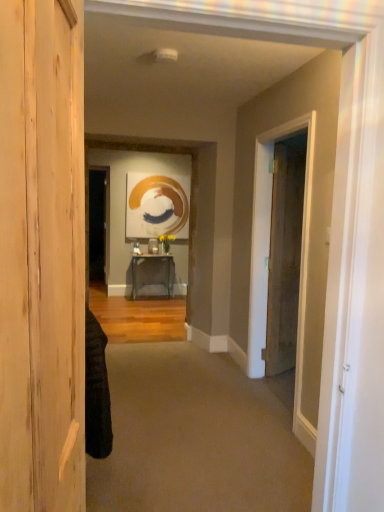
This screenshot has height=512, width=384. Describe the element at coordinates (285, 254) in the screenshot. I see `brown wood door at right, the second door in the front-to-back sequence` at that location.

Identify the location of metallic gray table at center. This screenshot has height=512, width=384. pyautogui.click(x=150, y=258).

Where is `brown wood door at right, the 1th door positioned from the back`? The image size is (384, 512). brown wood door at right, the 1th door positioned from the back is located at coordinates (285, 254).

From a real-world perspective, between natural wood door at left, which is the first door in left-to-right order, and carpet at center, who is vertically lower?

In real-world perspective, carpet at center is lower.

Which object is positioned more to the right, natural wood door at left, which ranks as the second door in back-to-front order, or carpet at center?

Positioned to the right is carpet at center.

From the image's perspective, is natural wood door at left, which ranks as the second door in back-to-front order, above or below carpet at center?

Clearly, from the image's perspective, natural wood door at left, which ranks as the second door in back-to-front order, is above carpet at center.

Looking at this image, is natural wood door at left, which ranks as the second door in back-to-front order, touching carpet at center?

natural wood door at left, which ranks as the second door in back-to-front order, and carpet at center are clearly separated.

This screenshot has width=384, height=512. I want to click on table located on the left of natural wood door at left, the second door when ordered from right to left, so click(150, 258).

In terms of size, does natural wood door at left, the second door when ordered from right to left, appear bigger or smaller than metallic gray table at center?

Clearly, natural wood door at left, the second door when ordered from right to left, is smaller in size than metallic gray table at center.

Consider the image. Is natural wood door at left, which ranks as the second door in back-to-front order, taller or shorter than metallic gray table at center?

natural wood door at left, which ranks as the second door in back-to-front order, is taller than metallic gray table at center.

How far apart are natural wood door at left, which ranks as the second door in back-to-front order, and metallic gray table at center?

The distance of natural wood door at left, which ranks as the second door in back-to-front order, from metallic gray table at center is 15.16 feet.

Which object is positioned more to the right, brown wood door at right, placed as the 2th door when sorted from left to right, or metallic gray table at center?

brown wood door at right, placed as the 2th door when sorted from left to right.

In terms of size, does brown wood door at right, the second door in the front-to-back sequence, appear bigger or smaller than metallic gray table at center?

In the image, brown wood door at right, the second door in the front-to-back sequence, appears to be smaller than metallic gray table at center.

Could you tell me if brown wood door at right, which appears as the first door when viewed from the right, is facing metallic gray table at center?

No, brown wood door at right, which appears as the first door when viewed from the right, is not turned towards metallic gray table at center.

Consider the image. Is metallic gray table at center bigger than brown wood door at right, placed as the 2th door when sorted from left to right?

Yes, metallic gray table at center is bigger than brown wood door at right, placed as the 2th door when sorted from left to right.

Would you say brown wood door at right, the second door in the front-to-back sequence, is part of metallic gray table at center's contents?

Definitely not — brown wood door at right, the second door in the front-to-back sequence, is not inside metallic gray table at center.

Is metallic gray table at center in front of brown wood door at right, which appears as the first door when viewed from the right?

That is False.

Is metallic gray table at center located outside carpet at center?

Yes.

Is metallic gray table at center next to carpet at center?

No, metallic gray table at center is not with carpet at center.

Who is bigger, metallic gray table at center or carpet at center?

Bigger between the two is metallic gray table at center.

Is carpet at center at the back of metallic gray table at center?

No.

Is point (54, 353) positioned in front of point (285, 333)?

Yes, point (54, 353) is in front of point (285, 333).

Who is smaller, natural wood door at left, which is the first door in left-to-right order, or brown wood door at right, the second door in the front-to-back sequence?

brown wood door at right, the second door in the front-to-back sequence.

Consider the image. Who is more distant, natural wood door at left, which ranks as the first door in front-to-back order, or brown wood door at right, the second door in the front-to-back sequence?

brown wood door at right, the second door in the front-to-back sequence, is further away from the camera.

Which is correct: natural wood door at left, the second door when ordered from right to left, is inside brown wood door at right, which appears as the first door when viewed from the right, or outside of it?

natural wood door at left, the second door when ordered from right to left, exists outside the volume of brown wood door at right, which appears as the first door when viewed from the right.

Considering the sizes of objects carpet at center and natural wood door at left, which is the first door in left-to-right order, in the image provided, who is shorter, carpet at center or natural wood door at left, which is the first door in left-to-right order,?

Standing shorter between the two is carpet at center.

Where is `plain behind the natural wood door at left, which is the first door in left-to-right order`? The image size is (384, 512). plain behind the natural wood door at left, which is the first door in left-to-right order is located at coordinates (197, 436).

Is carpet at center not near natural wood door at left, which ranks as the first door in front-to-back order?

Yes, carpet at center is far from natural wood door at left, which ranks as the first door in front-to-back order.

From a real-world perspective, which is physically below, carpet at center or natural wood door at left, which ranks as the first door in front-to-back order?

carpet at center.

Identify the location of plain on the right of natural wood door at left, which ranks as the first door in front-to-back order. (197, 436).

This screenshot has height=512, width=384. What are the coordinates of `table lying on the left of natural wood door at left, which is the first door in left-to-right order` in the screenshot? It's located at (150, 258).

Which object lies nearer to the anchor point carpet at center, brown wood door at right, which appears as the first door when viewed from the right, or metallic gray table at center?

Among the two, brown wood door at right, which appears as the first door when viewed from the right, is located nearer to carpet at center.

Considering their positions, is metallic gray table at center positioned closer to carpet at center than brown wood door at right, the 1th door positioned from the back?

brown wood door at right, the 1th door positioned from the back, is positioned closer to the anchor carpet at center.

Considering their positions, is metallic gray table at center positioned closer to natural wood door at left, the second door when ordered from right to left, than brown wood door at right, the 1th door positioned from the back?

brown wood door at right, the 1th door positioned from the back, is closer to natural wood door at left, the second door when ordered from right to left.

Based on their spatial positions, is carpet at center or natural wood door at left, which ranks as the second door in back-to-front order, further from metallic gray table at center?

natural wood door at left, which ranks as the second door in back-to-front order.

In the scene shown: When comparing their distances from carpet at center, does brown wood door at right, which appears as the first door when viewed from the right, or natural wood door at left, which is the first door in left-to-right order, seem closer?

brown wood door at right, which appears as the first door when viewed from the right, lies closer to carpet at center than the other object.

Which object lies further to the anchor point carpet at center, natural wood door at left, the second door when ordered from right to left, or metallic gray table at center?

metallic gray table at center.

Looking at the image, which one is located closer to carpet at center, natural wood door at left, the second door when ordered from right to left, or brown wood door at right, the second door in the front-to-back sequence?

Based on the image, brown wood door at right, the second door in the front-to-back sequence, appears to be nearer to carpet at center.

Estimate the real-world distances between objects in this image. Which object is closer to metallic gray table at center, brown wood door at right, placed as the 2th door when sorted from left to right, or natural wood door at left, which ranks as the first door in front-to-back order?

brown wood door at right, placed as the 2th door when sorted from left to right, is positioned closer to the anchor metallic gray table at center.

At what (x,y) coordinates should I click in order to perform the action: click on door between carpet at center and metallic gray table at center along the z-axis. Please return your answer as a coordinate pair (x, y). The height and width of the screenshot is (512, 384). Looking at the image, I should click on (285, 254).

Where is `plain between natural wood door at left, which is the first door in left-to-right order, and metallic gray table at center in the front-back direction`? The height and width of the screenshot is (512, 384). plain between natural wood door at left, which is the first door in left-to-right order, and metallic gray table at center in the front-back direction is located at coordinates (197, 436).

Identify the location of plain positioned between natural wood door at left, the second door when ordered from right to left, and brown wood door at right, the second door in the front-to-back sequence, from near to far. [197, 436].

Where is `door positioned between natural wood door at left, which is the first door in left-to-right order, and metallic gray table at center from near to far`? door positioned between natural wood door at left, which is the first door in left-to-right order, and metallic gray table at center from near to far is located at coordinates (285, 254).